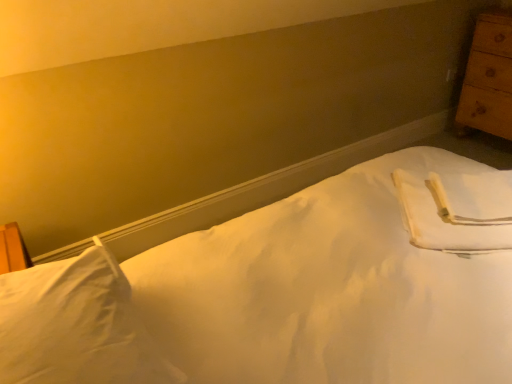
Question: In terms of height, does wooden chest of drawers at right look taller or shorter compared to white soft pillow at lower left?

Choices:
 (A) short
 (B) tall

Answer: (B)

Question: From a real-world perspective, is wooden chest of drawers at right positioned above or below white soft pillow at lower left?

Choices:
 (A) below
 (B) above

Answer: (A)

Question: Which object is the farthest from the white soft pillow at lower left?

Choices:
 (A) wooden chest of drawers at right
 (B) white smooth bed at center

Answer: (A)

Question: Which is farther from the white smooth bed at center?

Choices:
 (A) white soft pillow at lower left
 (B) wooden chest of drawers at right

Answer: (B)